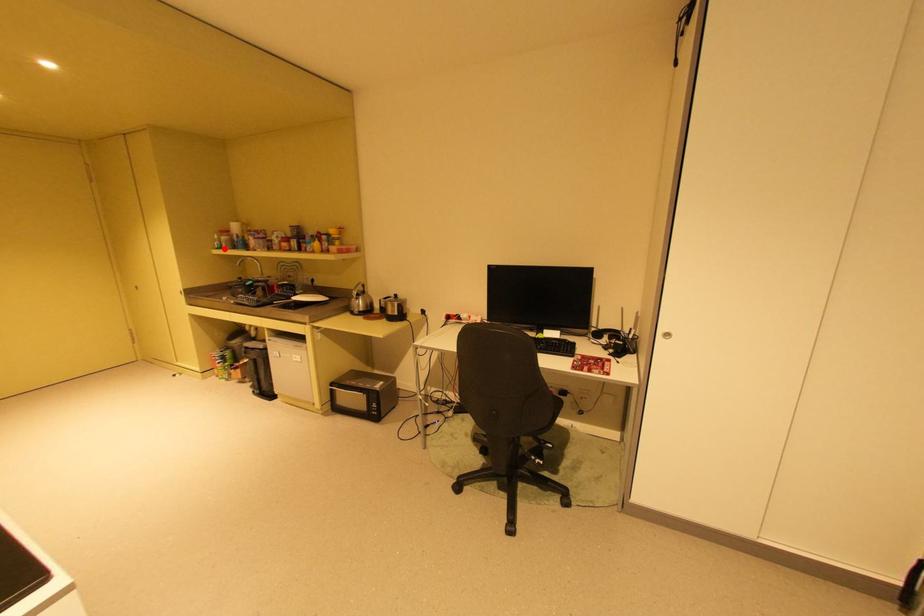
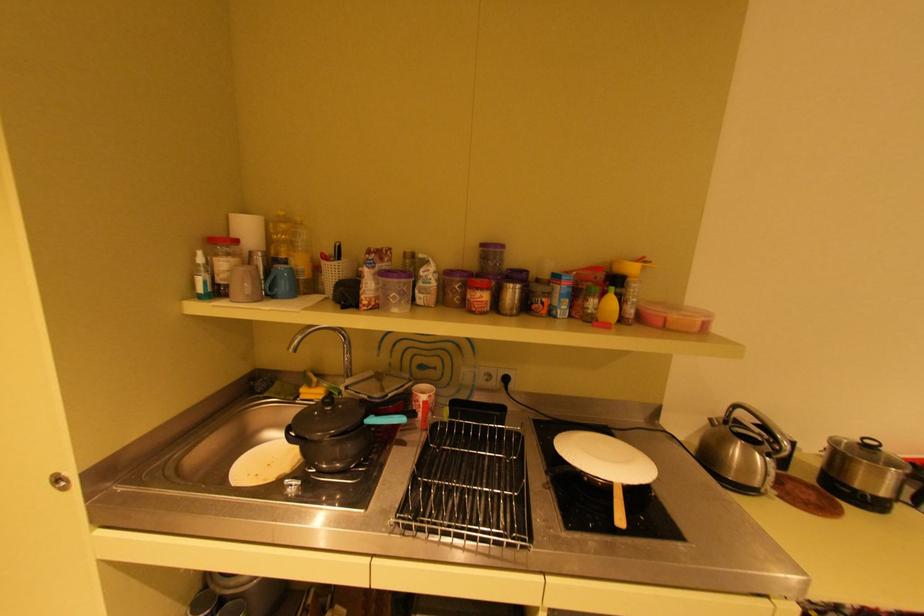
Find the pixel in the second image that matches the highlighted location in the first image.

(208, 297)